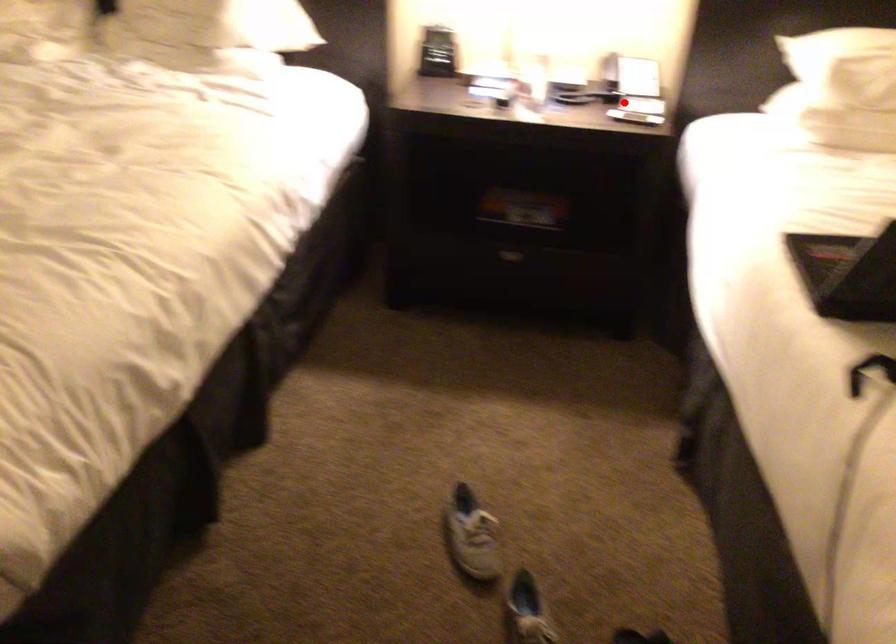
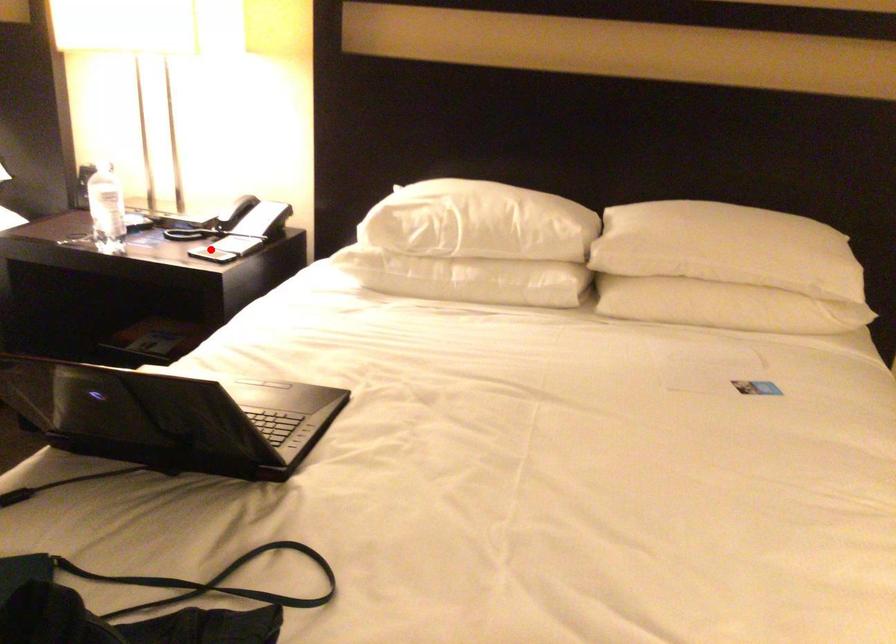
I am providing you with two images of the same scene from different viewpoints. A red point is marked on the first image and another point is marked on the second image. Are the points marked in image1 and image2 representing the same 3D position?

Yes